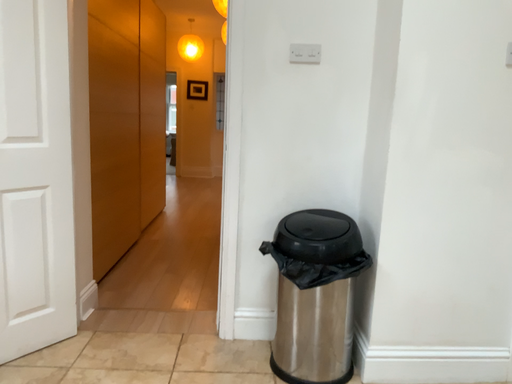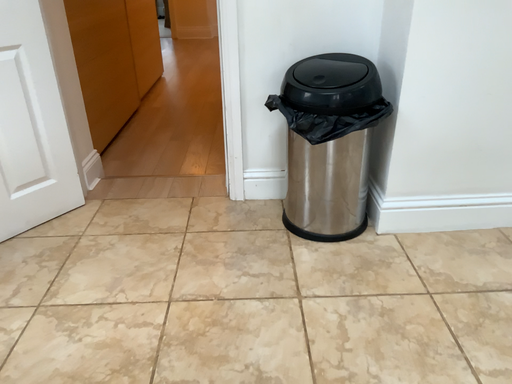
Question: Which way did the camera rotate in the video?

Choices:
 (A) rotated upward
 (B) rotated downward

Answer: (B)